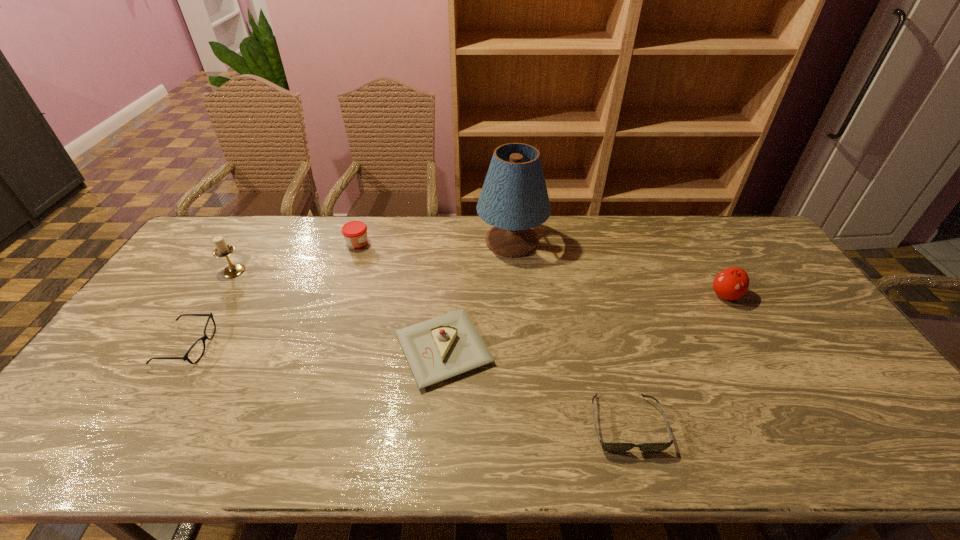
This screenshot has width=960, height=540. What are the coordinates of `free space between the jam and the second shortest object` in the screenshot? It's located at (274, 295).

I want to click on free space between the cake and the sunglasses, so click(535, 386).

The image size is (960, 540). Find the location of `vacant area between the cake and the candle holder`. vacant area between the cake and the candle holder is located at coordinates (339, 310).

At what (x,y) coordinates should I click in order to perform the action: click on free space between the spectacles and the nearest object. Please return your answer as a coordinate pair (x, y). Image resolution: width=960 pixels, height=540 pixels. Looking at the image, I should click on (407, 385).

Find the location of a particular element. free space between the cake and the second shortest object is located at coordinates (317, 348).

Identify which object is located as the sixth nearest to the cake. Please provide its 2D coordinates. Your answer should be formatted as a tuple, i.e. [(x, y)], where the tuple contains the x and y coordinates of a point satisfying the conditions above.

[(732, 283)]

Choose which object is the nearest neighbor to the cake. Please provide its 2D coordinates. Your answer should be formatted as a tuple, i.e. [(x, y)], where the tuple contains the x and y coordinates of a point satisfying the conditions above.

[(610, 447)]

At what (x,y) coordinates should I click in order to perform the action: click on free space that satisfies the following two spatial constraints: 1. on the back side of the tallest object; 2. on the right side of the candle holder. Please return your answer as a coordinate pair (x, y). The image size is (960, 540). Looking at the image, I should click on (252, 241).

The height and width of the screenshot is (540, 960). Find the location of `blank space that satisfies the following two spatial constraints: 1. on the label side of the cake; 2. on the left side of the third object from left to right`. blank space that satisfies the following two spatial constraints: 1. on the label side of the cake; 2. on the left side of the third object from left to right is located at coordinates (323, 349).

Locate an element on the screen. Image resolution: width=960 pixels, height=540 pixels. free spot that satisfies the following two spatial constraints: 1. on the back side of the cake; 2. on the right side of the rightmost object is located at coordinates (448, 295).